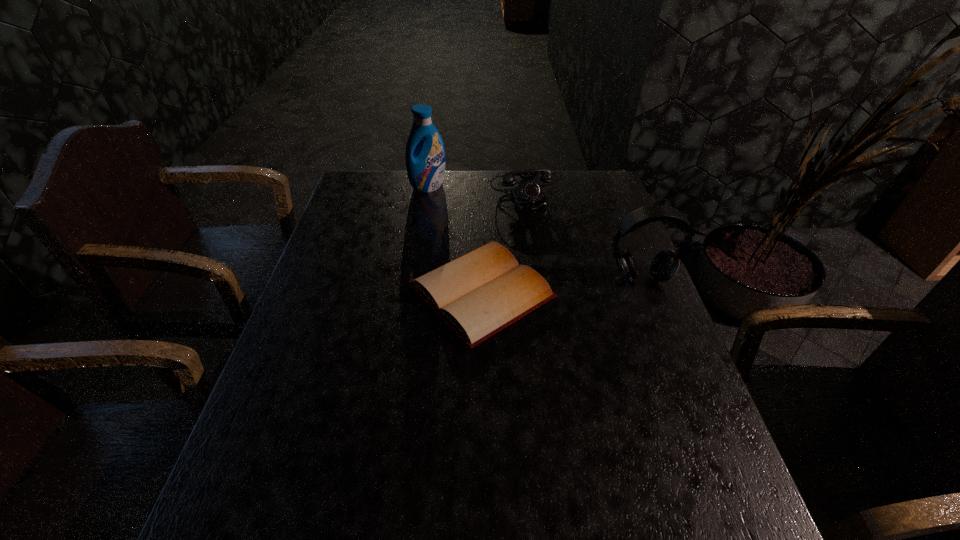
Identify the location of free space on the desktop that is between the shortest object and the earphone and is positioned on the front-facing side of the telephone. Image resolution: width=960 pixels, height=540 pixels. [x=567, y=284].

Where is `vacant space on the desktop that is between the shortest object and the rightmost object and is positioned on the front-facing side of the detergent`? The height and width of the screenshot is (540, 960). vacant space on the desktop that is between the shortest object and the rightmost object and is positioned on the front-facing side of the detergent is located at coordinates [x=549, y=286].